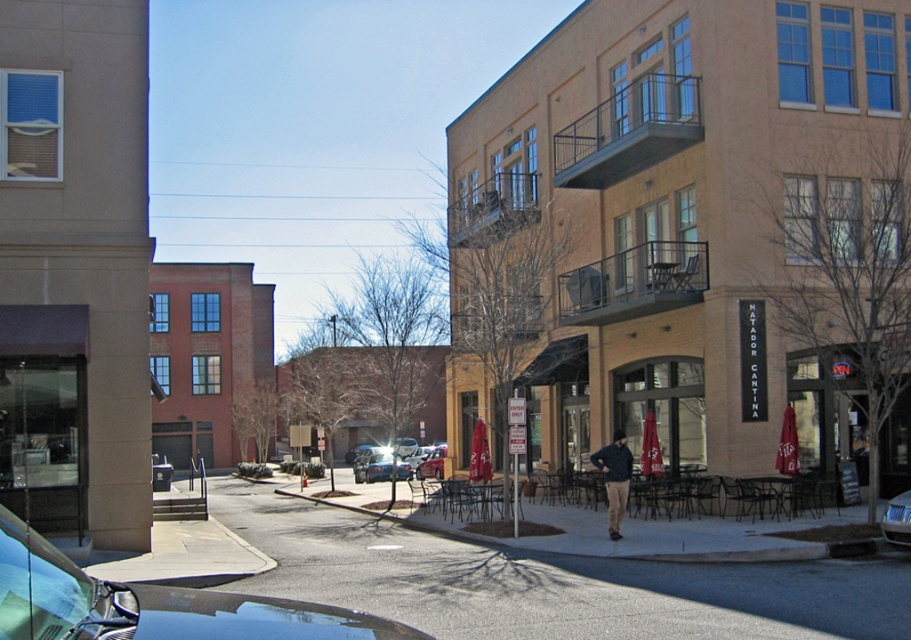
You are a delivery person who needs to park your shiny blue car at lower left in a spot that is not obstructing the entrance of the MATADOR CANTINA. Based on the scene, where should you park your car so it doesn

The shiny blue car at lower left should be parked away from the entrance of the MATADOR CANTINA to avoid blocking it. Since the car is currently at position point [151,604], moving it further away from the building or to a designated parking area would be appropriate.

You are a delivery driver who needs to park your vehicle between the shiny blue car at lower left and the metallic silver sedan at center. Can you fit your 2.5 meter wide truck there?

The shiny blue car at lower left is positioned on the right side of metallic silver sedan at center, meaning there is space between them. However, the distance between the two cars isn not specified. Without knowing the exact gap, it is impossible to determine if the 2.5 meter wide truck can fit.